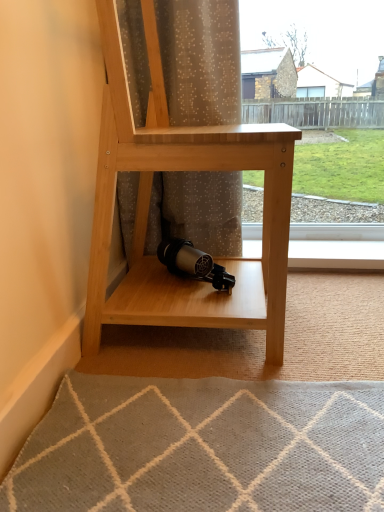
Question: Does translucent fabric curtain at center have a greater height compared to natural wood shelf at center?

Choices:
 (A) yes
 (B) no

Answer: (B)

Question: Can we say translucent fabric curtain at center lies outside natural wood shelf at center?

Choices:
 (A) yes
 (B) no

Answer: (A)

Question: Is translucent fabric curtain at center positioned with its back to natural wood shelf at center?

Choices:
 (A) no
 (B) yes

Answer: (B)

Question: Could you tell me if translucent fabric curtain at center is turned towards natural wood shelf at center?

Choices:
 (A) yes
 (B) no

Answer: (A)

Question: Is translucent fabric curtain at center to the right of natural wood shelf at center from the viewer's perspective?

Choices:
 (A) no
 (B) yes

Answer: (A)

Question: Considering the relative positions of translucent fabric curtain at center and natural wood shelf at center in the image provided, is translucent fabric curtain at center in front of natural wood shelf at center?

Choices:
 (A) yes
 (B) no

Answer: (B)

Question: Does natural wood shelf at center have a greater width compared to translucent fabric curtain at center?

Choices:
 (A) yes
 (B) no

Answer: (A)

Question: Is natural wood shelf at center turned away from translucent fabric curtain at center?

Choices:
 (A) yes
 (B) no

Answer: (B)

Question: Considering the relative positions of natural wood shelf at center and translucent fabric curtain at center in the image provided, is natural wood shelf at center to the left of translucent fabric curtain at center from the viewer's perspective?

Choices:
 (A) no
 (B) yes

Answer: (A)

Question: Considering the relative sizes of natural wood shelf at center and translucent fabric curtain at center in the image provided, is natural wood shelf at center bigger than translucent fabric curtain at center?

Choices:
 (A) no
 (B) yes

Answer: (B)

Question: Is natural wood shelf at center positioned beyond the bounds of translucent fabric curtain at center?

Choices:
 (A) no
 (B) yes

Answer: (B)

Question: Is the depth of natural wood shelf at center greater than that of translucent fabric curtain at center?

Choices:
 (A) no
 (B) yes

Answer: (A)

Question: From a real-world perspective, is natural wood shelf at center above or below translucent fabric curtain at center?

Choices:
 (A) below
 (B) above

Answer: (A)